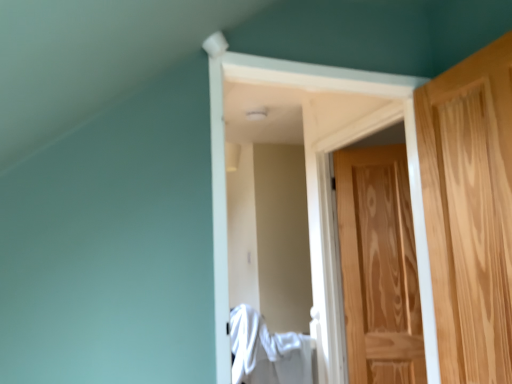
Question: From a real-world perspective, is natural wood door at right, which is the second door from front to back, positioned above or below white fabric at center?

Choices:
 (A) below
 (B) above

Answer: (B)

Question: Is point (342, 259) closer or farther from the camera than point (307, 379)?

Choices:
 (A) closer
 (B) farther

Answer: (B)

Question: Which of these objects is positioned farthest from the light brown wood door at right, positioned as the 1th door in front-to-back order?

Choices:
 (A) white fabric at center
 (B) natural wood door at right, which is the second door from front to back

Answer: (A)

Question: Based on their relative distances, which object is farther from the light brown wood door at right, the second door positioned from the back?

Choices:
 (A) natural wood door at right, which appears as the 1th door when viewed from the back
 (B) white fabric at center

Answer: (B)